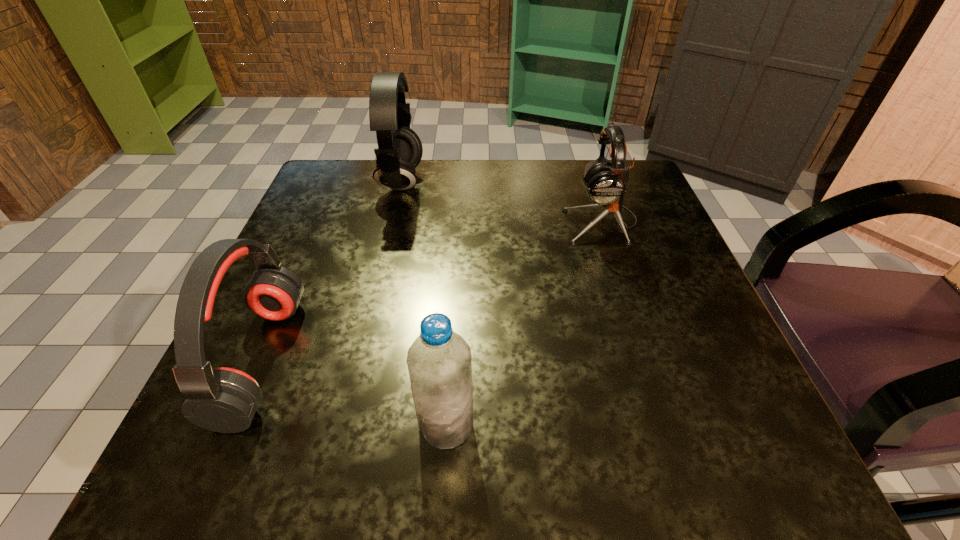
You are a GUI agent. You are given a task and a screenshot of the screen. Output one action in this format:
    pyautogui.click(x=<x>, y=<y>)
    Task: Click on the free space between the water bottle and the nearest earphone
    The image size is (960, 540).
    Given the screenshot: What is the action you would take?
    pyautogui.click(x=354, y=392)

Image resolution: width=960 pixels, height=540 pixels. Identify the location of free space between the water bottle and the leftmost earphone. (354, 392).

In order to click on object that is the closest one to the rightmost earphone in this screenshot , I will do `click(399, 152)`.

Locate an element on the screen. The width and height of the screenshot is (960, 540). the third closest object relative to the leftmost earphone is located at coordinates (606, 183).

Identify the location of the closest earphone relative to the rightmost earphone. This screenshot has width=960, height=540. (399, 152).

Select which earphone appears as the second closest to the second earphone from left to right. Please provide its 2D coordinates. Your answer should be formatted as a tuple, i.e. [(x, y)], where the tuple contains the x and y coordinates of a point satisfying the conditions above.

[(606, 183)]

I want to click on free space that satisfies the following two spatial constraints: 1. on the front side of the rightmost earphone; 2. on the ear cups of the leftmost earphone, so click(x=646, y=360).

Locate an element on the screen. This screenshot has height=540, width=960. vacant point that satisfies the following two spatial constraints: 1. on the ear cups of the second earphone from right to left; 2. on the back side of the rightmost earphone is located at coordinates (x=392, y=222).

Where is `vacant space that satisfies the following two spatial constraints: 1. on the ear cups of the third object from right to left; 2. on the right side of the second object from right to left`? The image size is (960, 540). vacant space that satisfies the following two spatial constraints: 1. on the ear cups of the third object from right to left; 2. on the right side of the second object from right to left is located at coordinates (344, 424).

Locate an element on the screen. vacant area that satisfies the following two spatial constraints: 1. on the ear cups of the third object from right to left; 2. on the left side of the water bottle is located at coordinates (344, 424).